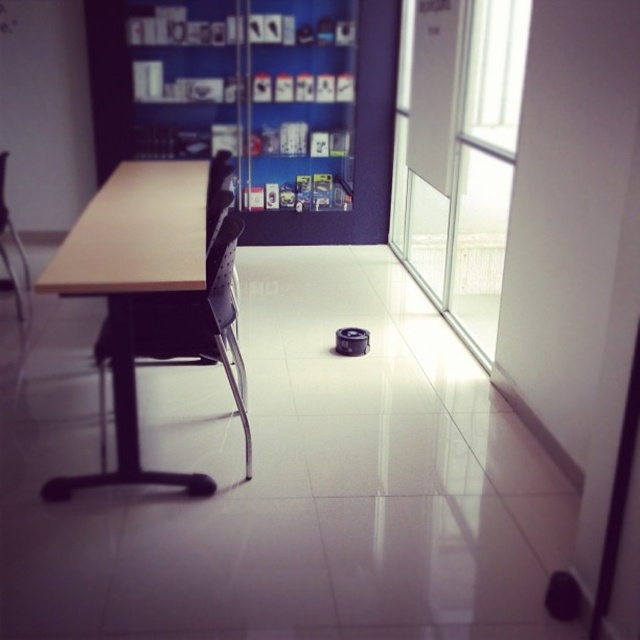
Question: Among these objects, which one is nearest to the camera?

Choices:
 (A) light brown wood table at center
 (B) matte plastic chair at left

Answer: (A)

Question: Is light brown wood table at center thinner than matte plastic chair at left?

Choices:
 (A) yes
 (B) no

Answer: (B)

Question: Which object appears closest to the camera in this image?

Choices:
 (A) matte plastic chair at left
 (B) light brown wood table at center

Answer: (B)

Question: Among these points, which one is farthest from the camera?

Choices:
 (A) (3, 168)
 (B) (118, 317)

Answer: (A)

Question: Is light brown wood table at center positioned behind matte plastic chair at left?

Choices:
 (A) yes
 (B) no

Answer: (B)

Question: Is light brown wood table at center smaller than matte plastic chair at left?

Choices:
 (A) no
 (B) yes

Answer: (A)